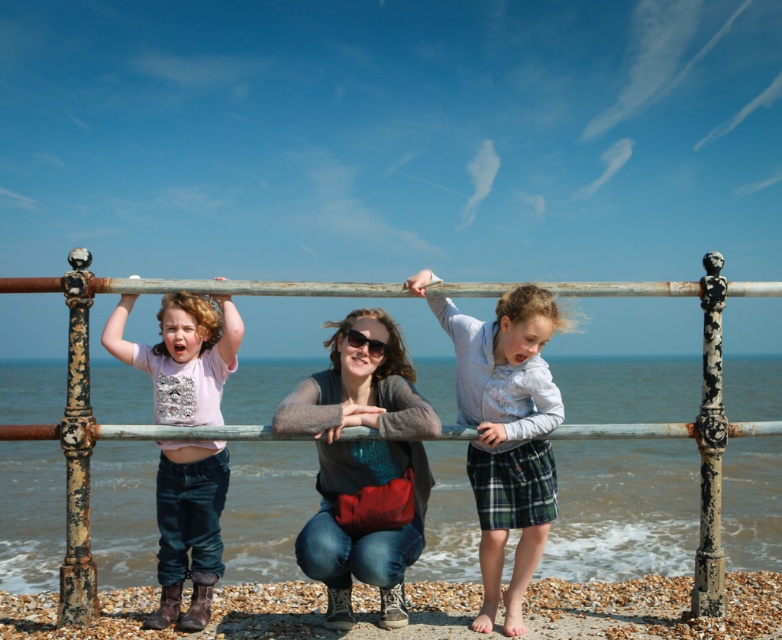
Question: Does smooth pebbles at lower center appear over green plaid kilt at lower right?

Choices:
 (A) yes
 (B) no

Answer: (B)

Question: Which object is farther from the camera taking this photo?

Choices:
 (A) green plaid kilt at lower right
 (B) rusty metal railing at center
 (C) matte black sunglasses at center

Answer: (B)

Question: Does rusty metal railing at center appear on the right side of light gray flannel shirt at center?

Choices:
 (A) no
 (B) yes

Answer: (B)

Question: Is light gray flannel shirt at center wider than matte pink shirt at left?

Choices:
 (A) no
 (B) yes

Answer: (B)

Question: Which point is closer to the camera taking this photo?

Choices:
 (A) (372, 339)
 (B) (372, 328)
 (C) (181, 524)
 (D) (723, 301)

Answer: (D)

Question: Which of the following is the closest to the observer?

Choices:
 (A) (307, 378)
 (B) (302, 586)

Answer: (A)